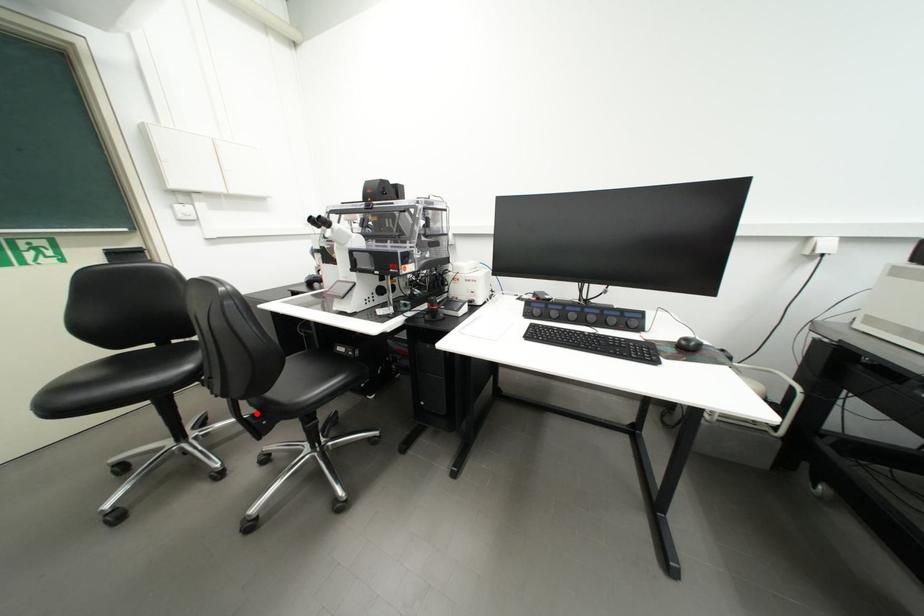
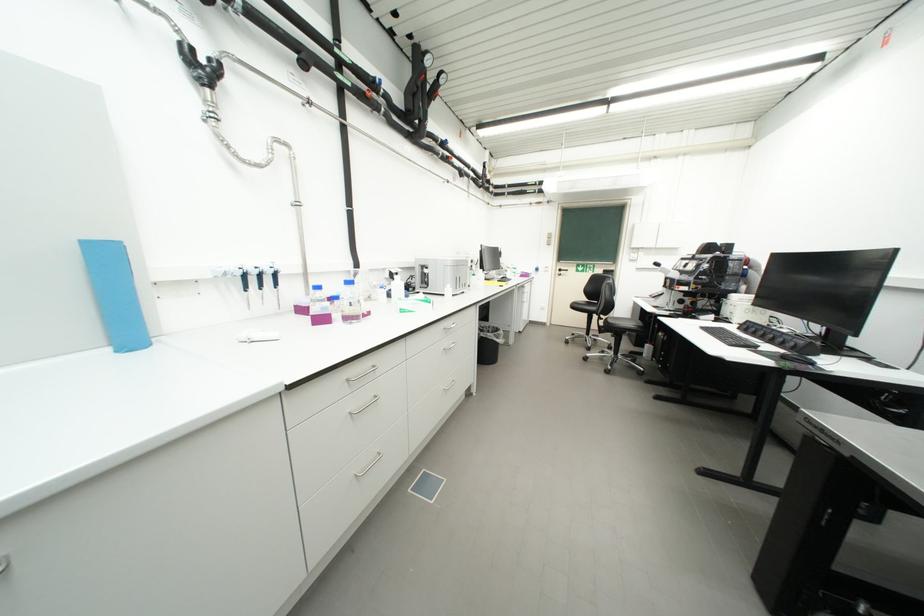
Question: A red point is marked in image1. In image2, is the corresponding 3D point closer to the camera or farther? Reply with the corresponding letter.

Choices:
 (A) The corresponding 3D point is closer.
 (B) The corresponding 3D point is farther.

Answer: (A)